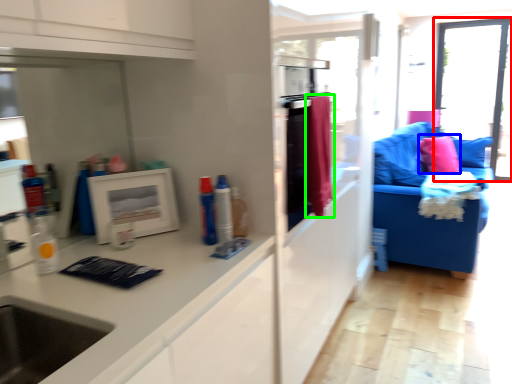
Question: Based on their relative distances, which object is farther from window (highlighted by a red box)? Choose from pillow (highlighted by a blue box) and material (highlighted by a green box).

Choices:
 (A) pillow
 (B) material

Answer: (B)